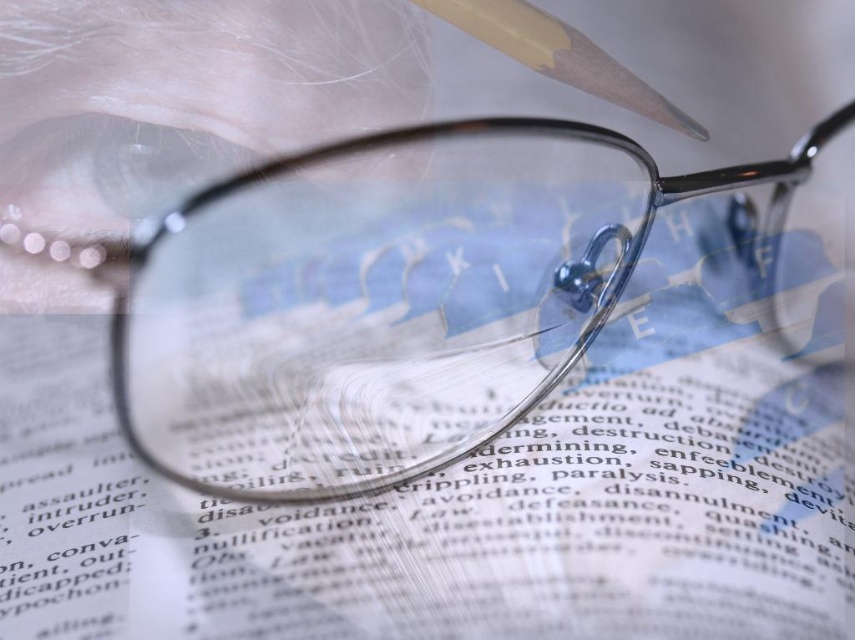
Can you confirm if matte black glasses at center is bigger than matte wood pencil at upper center?

Yes, matte black glasses at center is bigger than matte wood pencil at upper center.

Can you confirm if matte black glasses at center is wider than matte wood pencil at upper center?

Correct, the width of matte black glasses at center exceeds that of matte wood pencil at upper center.

This screenshot has width=855, height=640. Find the location of `matte black glasses at center`. matte black glasses at center is located at coordinates (392, 298).

Which is behind, point (688, 588) or point (765, 230)?

Point (765, 230)

Can you confirm if transparent plastic book at center is smaller than matte black glasses at center?

Indeed, transparent plastic book at center has a smaller size compared to matte black glasses at center.

The width and height of the screenshot is (855, 640). I want to click on transparent plastic book at center, so click(439, 518).

Can you confirm if transparent plastic book at center is shorter than matte wood pencil at upper center?

Incorrect, transparent plastic book at center's height does not fall short of matte wood pencil at upper center's.

Is transparent plastic book at center taller than matte wood pencil at upper center?

Correct, transparent plastic book at center is much taller as matte wood pencil at upper center.

You are a GUI agent. You are given a task and a screenshot of the screen. Output one action in this format:
    pyautogui.click(x=<x>, y=<y>)
    Task: Click on the transparent plastic book at center
    The height and width of the screenshot is (640, 855).
    Given the screenshot: What is the action you would take?
    [439, 518]